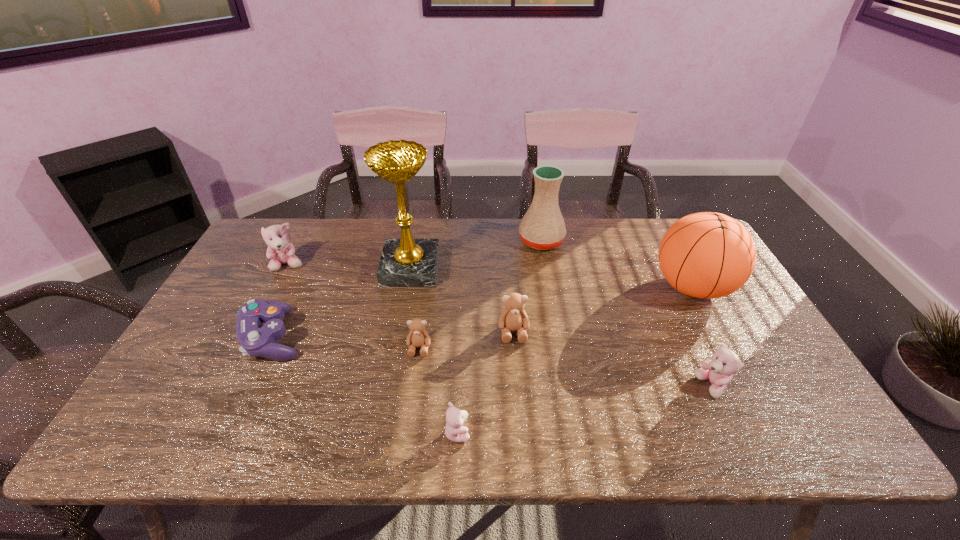
Locate an element on the screen. The height and width of the screenshot is (540, 960). teddy bear present at the left edge is located at coordinates (280, 251).

Find the location of a particular element. control that is at the left edge is located at coordinates (256, 339).

Locate an element on the screen. The image size is (960, 540). object that is at the right edge is located at coordinates (707, 255).

This screenshot has width=960, height=540. Find the location of `object at the far left corner`. object at the far left corner is located at coordinates (280, 251).

Locate an element on the screen. Image resolution: width=960 pixels, height=540 pixels. vacant space at the far edge is located at coordinates (327, 221).

You are a GUI agent. You are given a task and a screenshot of the screen. Output one action in this format:
    pyautogui.click(x=<x>, y=<y>)
    Task: Click on the vacant space at the near edge of the desktop
    The image size is (960, 540).
    Given the screenshot: What is the action you would take?
    pyautogui.click(x=372, y=420)

Where is `vacant region at the left edge`? This screenshot has height=540, width=960. vacant region at the left edge is located at coordinates 200,383.

Identify the location of vacant space at the right edge. The width and height of the screenshot is (960, 540). (775, 363).

The width and height of the screenshot is (960, 540). Find the location of `vacant area at the far right corner`. vacant area at the far right corner is located at coordinates (659, 237).

Where is `vacant region between the sixth shortest object and the fifth object from right to left`? This screenshot has width=960, height=540. vacant region between the sixth shortest object and the fifth object from right to left is located at coordinates (372, 349).